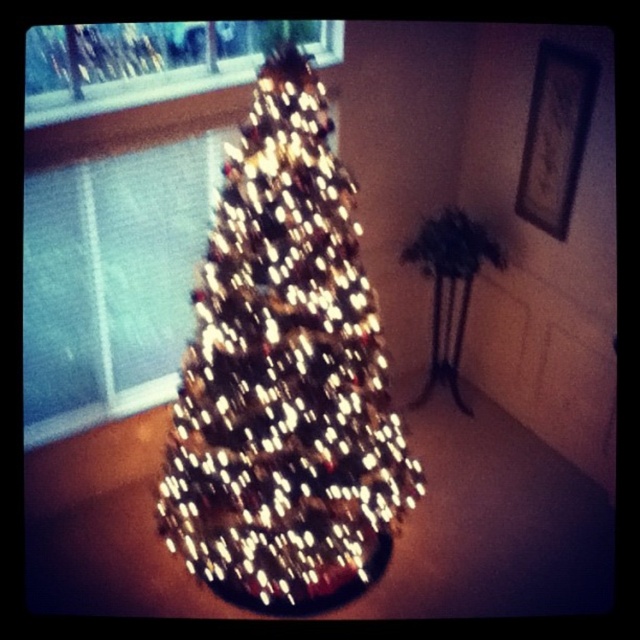
Who is shorter, iridescent glass christmas tree at center or transparent glass window at upper left?

transparent glass window at upper left is shorter.

The width and height of the screenshot is (640, 640). What do you see at coordinates (284, 374) in the screenshot?
I see `iridescent glass christmas tree at center` at bounding box center [284, 374].

What are the coordinates of `iridescent glass christmas tree at center` in the screenshot? It's located at pyautogui.click(x=284, y=374).